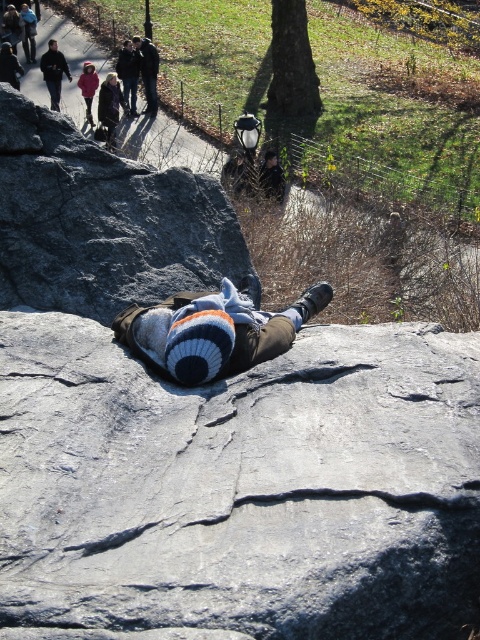
You are standing at the lower part of the image and looking towards the upper left corner. You see two people wearing jackets. Which jacket, the matte black jacket at upper left or the matte pink jacket at upper left, is located more to the left?

The matte black jacket at upper left is positioned on the left side of matte pink jacket at upper left, so the matte black jacket at upper left is more to the left.

You are standing in the park and see the gray rough rock at center and the matte pink jacket at upper left. Which object is closer to you?

The gray rough rock at center is closer to you because it is in front of the matte pink jacket at upper left.

From the picture: You are a photographer trying to capture both the gray rough rock at center and the dark blue knit sweater at upper center in a single frame. Which object should you focus on first to ensure both are in the frame without moving the camera?

You should focus on the gray rough rock at center first since it is larger than the dark blue knit sweater at upper center, allowing you to frame it properly while still including the smaller sweater in the shot.